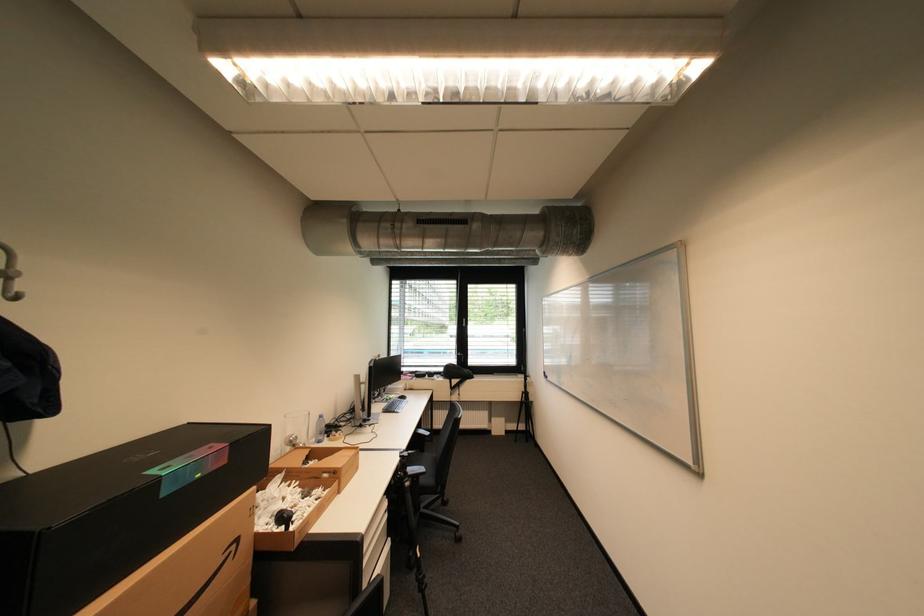
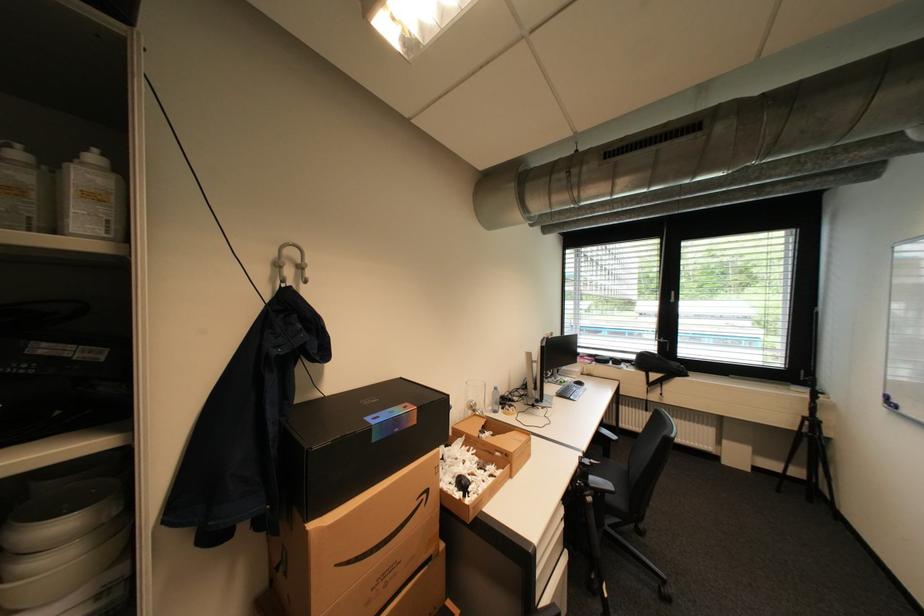
The point at (242, 546) is marked in the first image. Where is the corresponding point in the second image?

(433, 496)